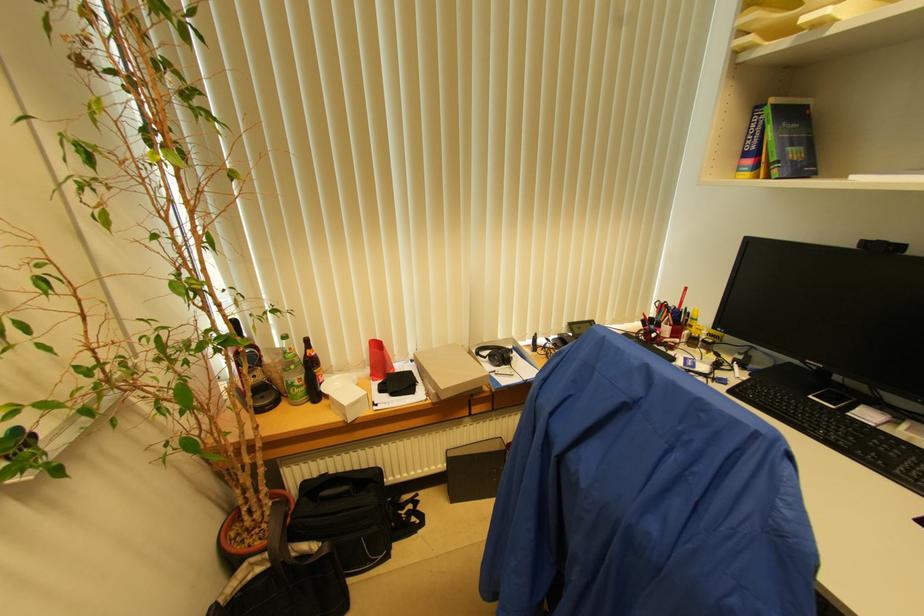
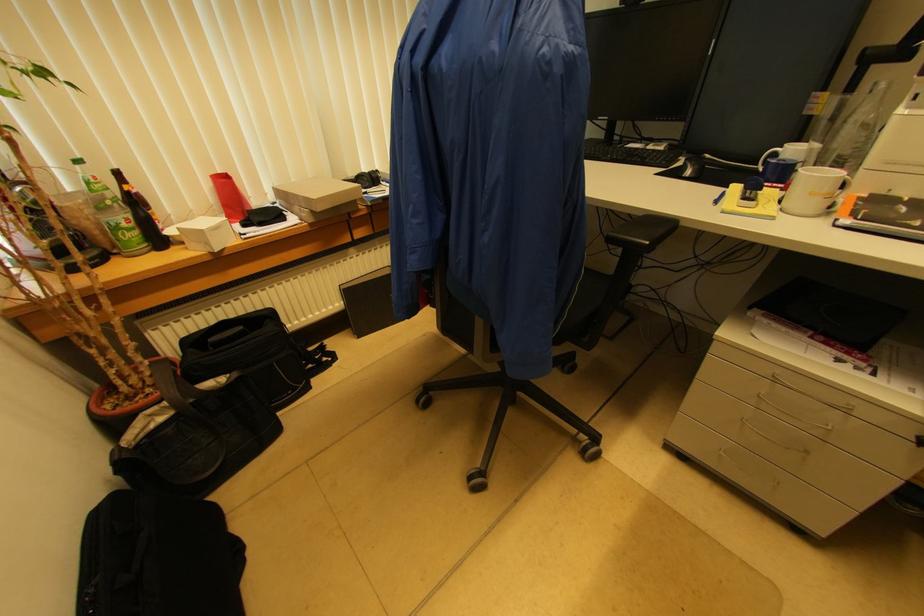
Find the pixel in the second image that matches [346,416] in the first image.

(209, 246)